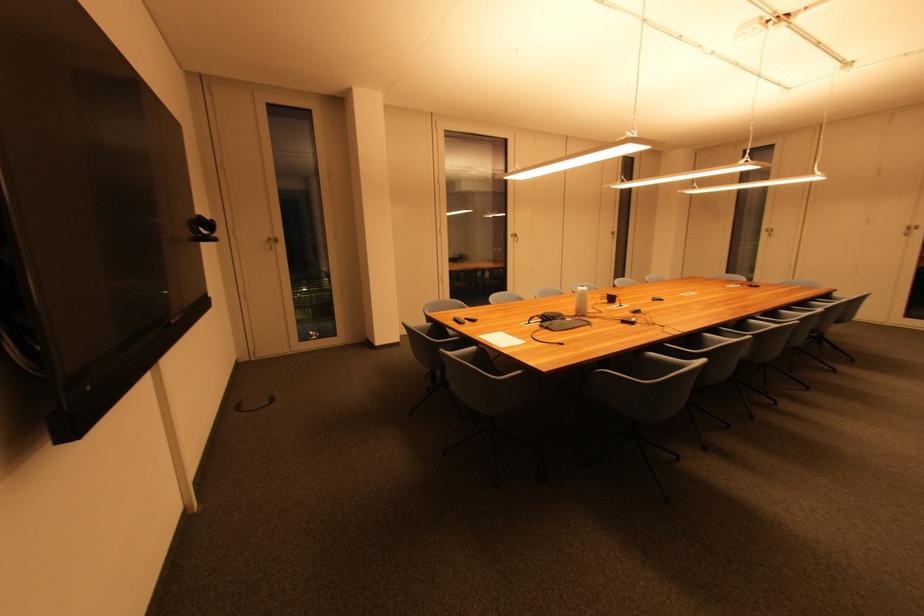
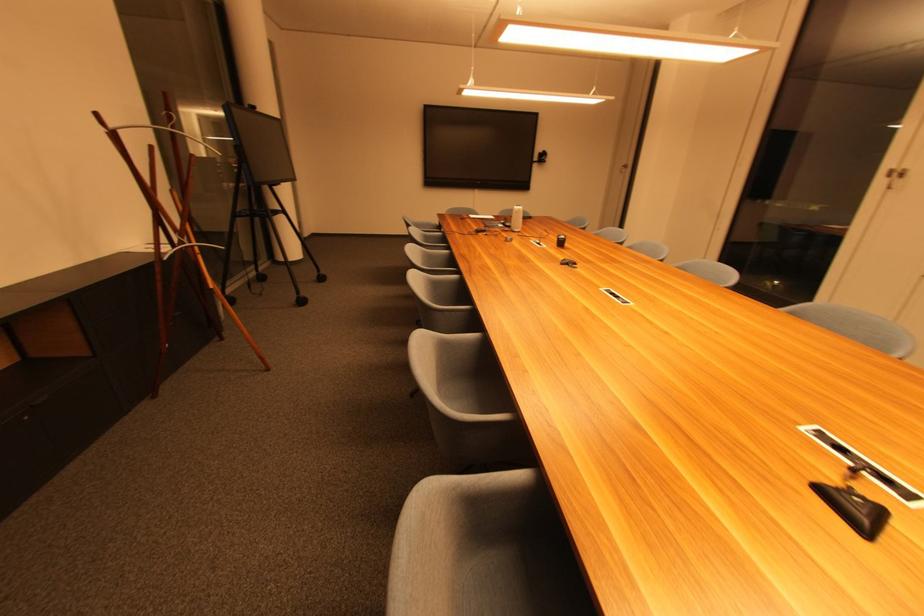
Locate, in the second image, the point that corresponds to the point at 517,235 in the first image.

(901, 169)